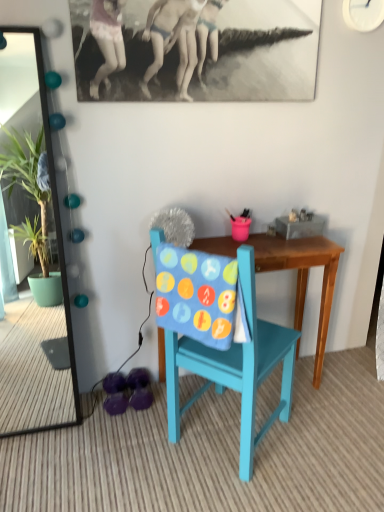
Identify the location of vacant area that is situated to the right of teal painted wood chair at center. (329, 439).